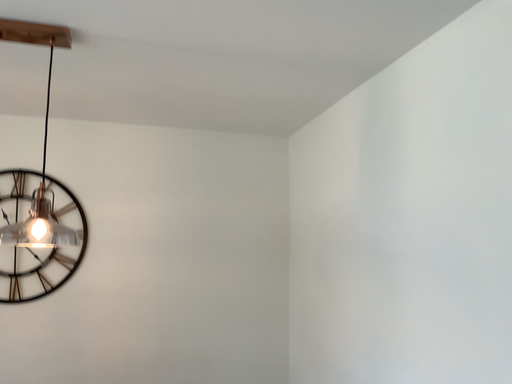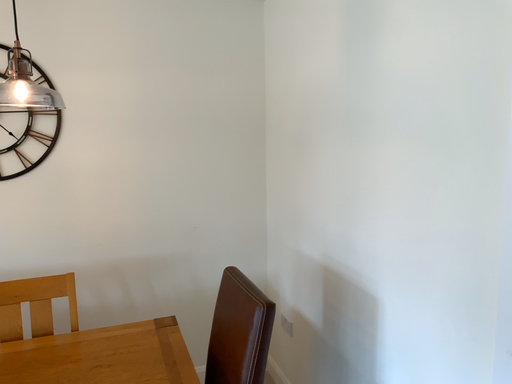
Question: How did the camera likely rotate when shooting the video?

Choices:
 (A) rotated downward
 (B) rotated upward

Answer: (A)